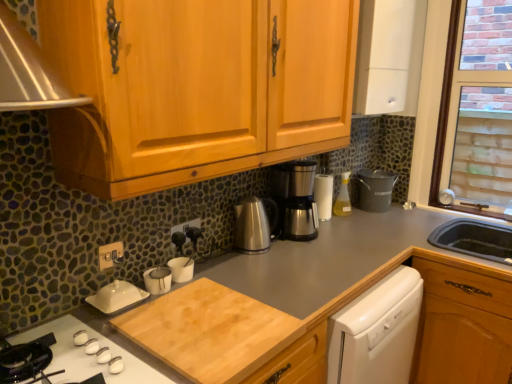
Question: Does satin silver coffee pot at center have a larger size compared to gold metallic switch at lower left, the first electric outlet from the front?

Choices:
 (A) no
 (B) yes

Answer: (B)

Question: Can we say satin silver coffee pot at center lies outside gold metallic switch at lower left, the 1th electric outlet viewed from the left?

Choices:
 (A) yes
 (B) no

Answer: (A)

Question: Can you confirm if satin silver coffee pot at center is shorter than gold metallic switch at lower left, arranged as the 2th electric outlet when viewed from the right?

Choices:
 (A) no
 (B) yes

Answer: (A)

Question: Is satin silver coffee pot at center oriented away from gold metallic switch at lower left, the 1th electric outlet viewed from the left?

Choices:
 (A) yes
 (B) no

Answer: (B)

Question: Are satin silver coffee pot at center and gold metallic switch at lower left, the 2th electric outlet positioned from the back, beside each other?

Choices:
 (A) yes
 (B) no

Answer: (B)

Question: From the image's perspective, is satin silver coffee pot at center located above gold metallic switch at lower left, arranged as the 2th electric outlet when viewed from the right?

Choices:
 (A) no
 (B) yes

Answer: (B)

Question: Can you confirm if brick-patterned glass at upper right is smaller than satin silver coffee pot at center?

Choices:
 (A) no
 (B) yes

Answer: (A)

Question: From the image's perspective, does brick-patterned glass at upper right appear lower than satin silver coffee pot at center?

Choices:
 (A) no
 (B) yes

Answer: (A)

Question: From a real-world perspective, does brick-patterned glass at upper right sit lower than satin silver coffee pot at center?

Choices:
 (A) no
 (B) yes

Answer: (A)

Question: From the image's perspective, is brick-patterned glass at upper right above satin silver coffee pot at center?

Choices:
 (A) no
 (B) yes

Answer: (B)

Question: Can you confirm if brick-patterned glass at upper right is thinner than satin silver coffee pot at center?

Choices:
 (A) yes
 (B) no

Answer: (A)

Question: Does brick-patterned glass at upper right touch satin silver coffee pot at center?

Choices:
 (A) no
 (B) yes

Answer: (A)

Question: Is translucent plastic spray bottle at center-right wider than white matte cabinet at upper right?

Choices:
 (A) yes
 (B) no

Answer: (B)